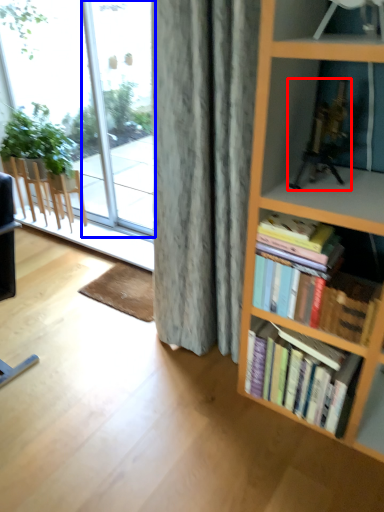
Question: Which object appears farthest to the camera in this image, toy (highlighted by a red box) or glass door (highlighted by a blue box)?

Choices:
 (A) toy
 (B) glass door

Answer: (B)